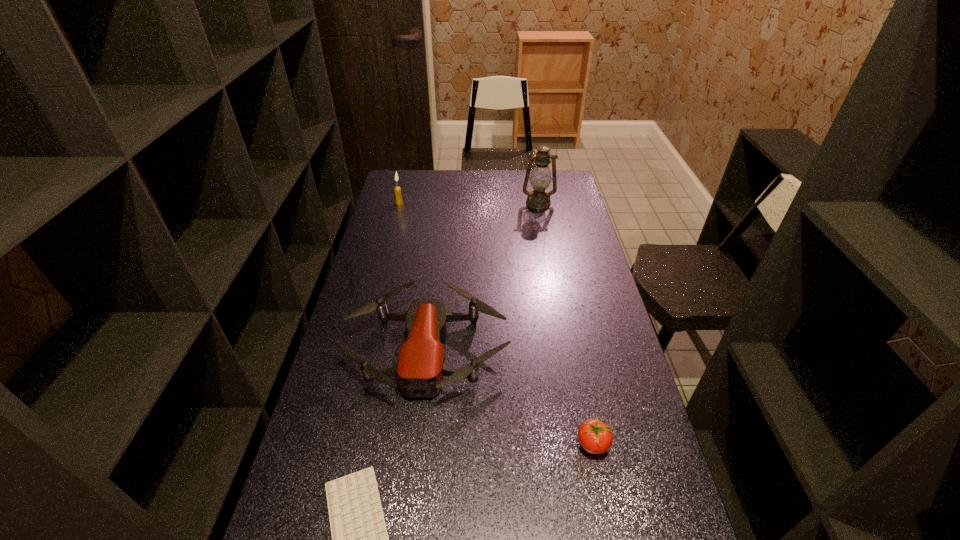
Locate which object is the closest to the third shortest object. Please provide its 2D coordinates. Your answer should be formatted as a tuple, i.e. [(x, y)], where the tuple contains the x and y coordinates of a point satisfying the conditions above.

[(595, 437)]

This screenshot has width=960, height=540. In order to click on object that is the fourth closest to the nearest object in this screenshot , I will do coord(540,179).

Where is `free space that satisfies the following two spatial constraints: 1. on the front-facing side of the second nearest object; 2. on the right side of the third tallest object`? The width and height of the screenshot is (960, 540). free space that satisfies the following two spatial constraints: 1. on the front-facing side of the second nearest object; 2. on the right side of the third tallest object is located at coordinates (415, 444).

You are a GUI agent. You are given a task and a screenshot of the screen. Output one action in this format:
    pyautogui.click(x=<x>, y=<y>)
    Task: Click on the vacant space that satisfies the following two spatial constraints: 1. on the front-facing side of the third farthest object; 2. on the left side of the fourth tallest object
    Image resolution: width=960 pixels, height=540 pixels.
    Given the screenshot: What is the action you would take?
    pyautogui.click(x=415, y=444)

This screenshot has height=540, width=960. In order to click on vacant space that satisfies the following two spatial constraints: 1. on the back side of the candle; 2. on the right side of the oil lamp in this screenshot , I will do `click(399, 202)`.

You are a GUI agent. You are given a task and a screenshot of the screen. Output one action in this format:
    pyautogui.click(x=<x>, y=<y>)
    Task: Click on the vacant space that satisfies the following two spatial constraints: 1. on the front-facing side of the third shortest object; 2. on the right side of the fourth farthest object
    This screenshot has width=960, height=540.
    Given the screenshot: What is the action you would take?
    point(415,444)